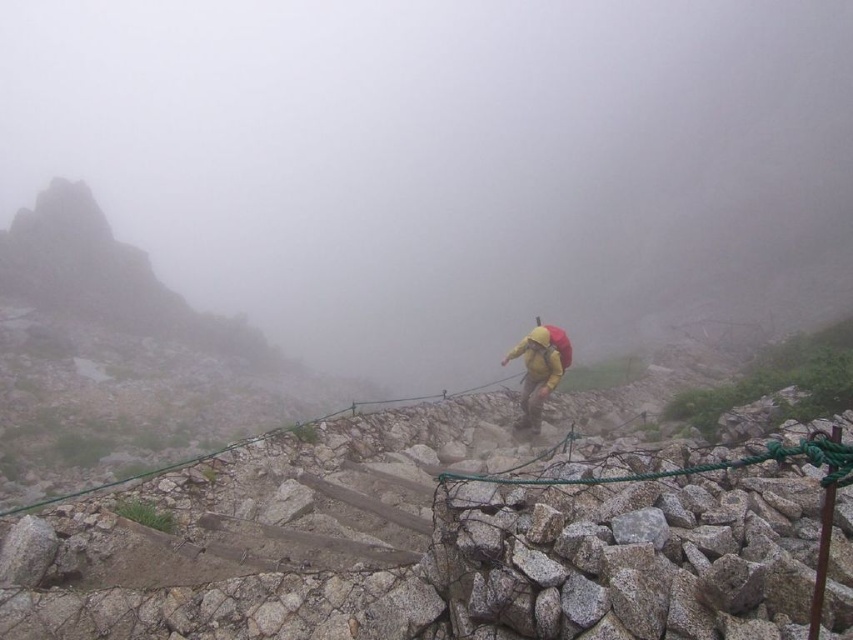
Looking at this image, you are a hiker trying to navigate the foggy mountain trail. You see the green rope at center and the yellow fabric backpack at center. Which object is positioned higher relative to the other?

The green rope at center is positioned above the yellow fabric backpack at center.